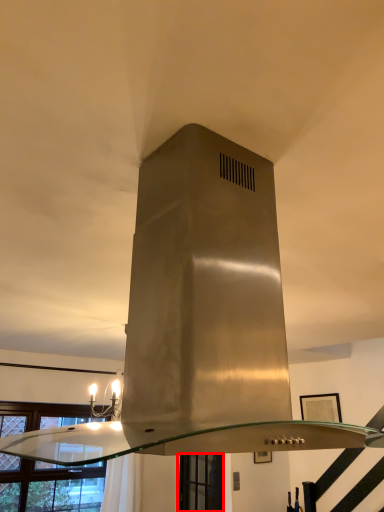
Question: From the image's perspective, what is the correct spatial relationship of window (annotated by the red box) in relation to window?

Choices:
 (A) below
 (B) above

Answer: (A)